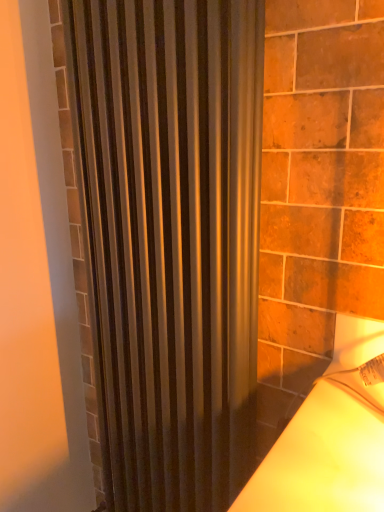
Find the location of a particular element. Image resolution: width=384 pixels, height=512 pixels. metallic silver curtain at center is located at coordinates (170, 240).

This screenshot has width=384, height=512. Describe the element at coordinates (170, 240) in the screenshot. I see `metallic silver curtain at center` at that location.

I want to click on metallic silver curtain at center, so click(170, 240).